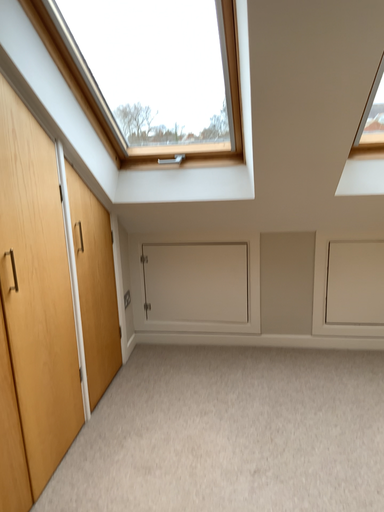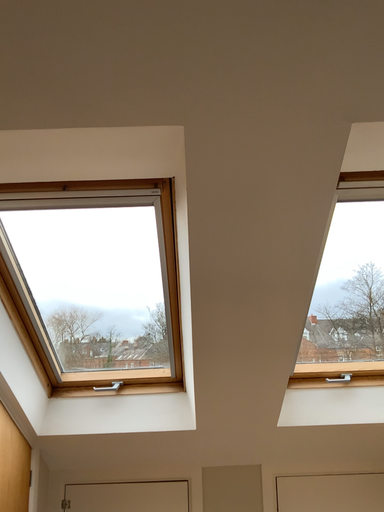
Question: Which way did the camera rotate in the video?

Choices:
 (A) rotated upward
 (B) rotated downward

Answer: (A)